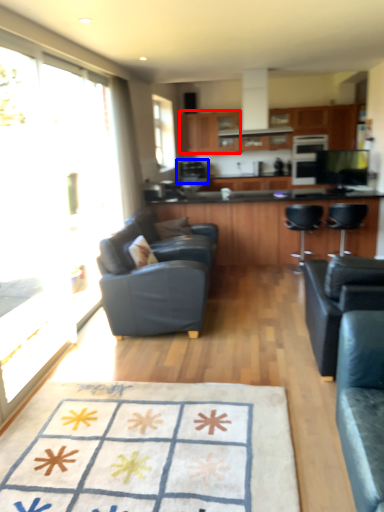
Question: Which of the following is the farthest to the observer, cabinetry (highlighted by a red box) or coffee machine (highlighted by a blue box)?

Choices:
 (A) cabinetry
 (B) coffee machine

Answer: (B)